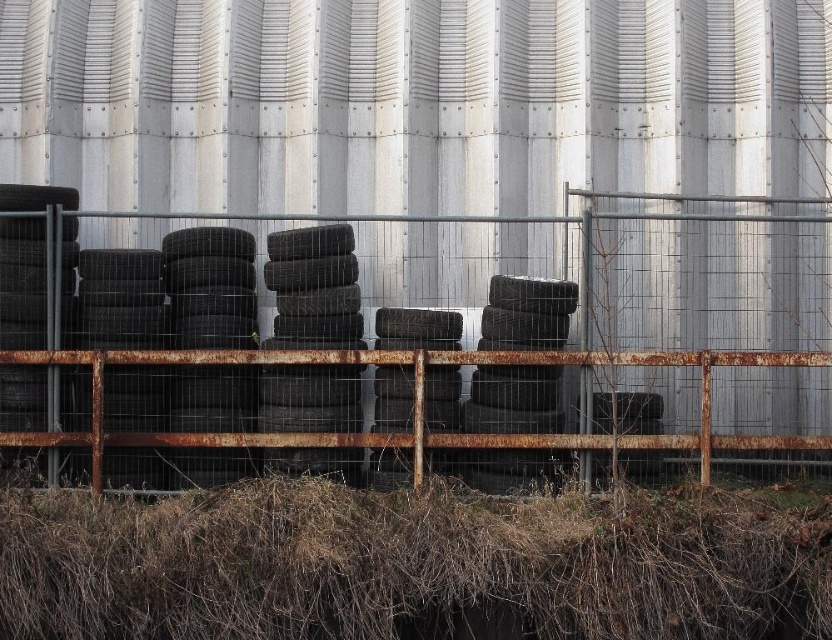
Is rusty metal fence at center taller than brown dry hay at bottom?

Indeed, rusty metal fence at center has a greater height compared to brown dry hay at bottom.

Is rusty metal fence at center above brown dry hay at bottom?

Yes.

Who is more distant from viewer, (706,285) or (691,522)?

The point (706,285) is more distant.

I want to click on rusty metal fence at center, so click(x=504, y=336).